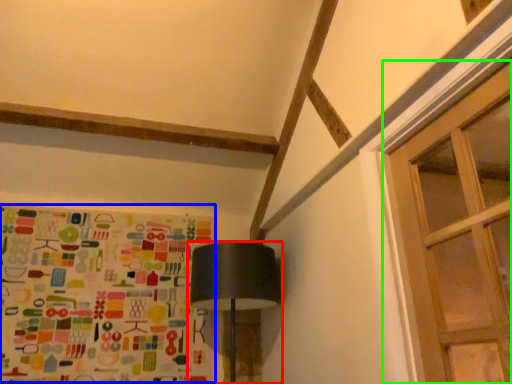
Question: Which is nearer to the lamp (highlighted by a red box)? print (highlighted by a blue box) or window (highlighted by a green box).

Choices:
 (A) print
 (B) window

Answer: (A)